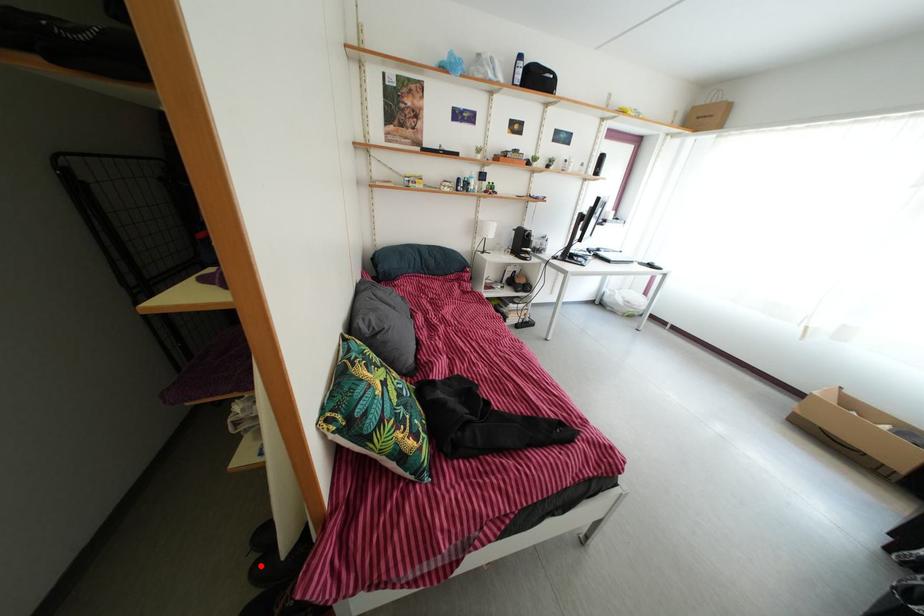
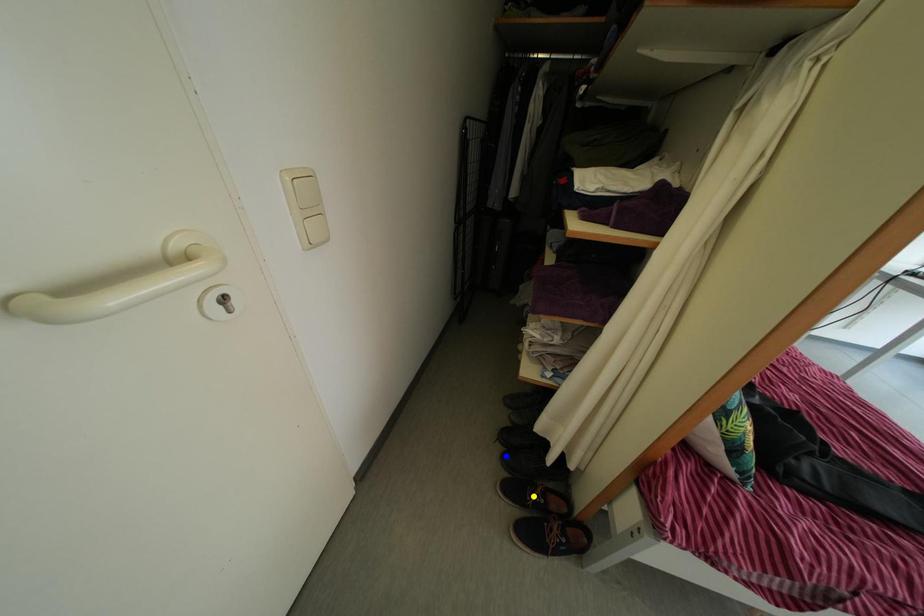
Question: I am providing you with two images of the same scene from different viewpoints. A red point is marked on the first image. You are given multiple points on the second image. Which point in image 2 represents the same 3d spot as the red point in image 1?

Choices:
 (A) blue point
 (B) green point
 (C) yellow point

Answer: (A)